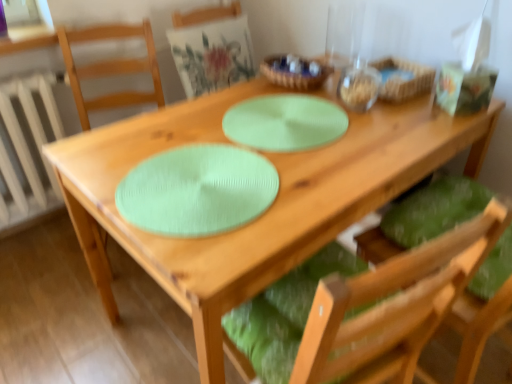
I want to click on free area in between mint green textured placemat at center and wooden bowl at upper center, so click(266, 123).